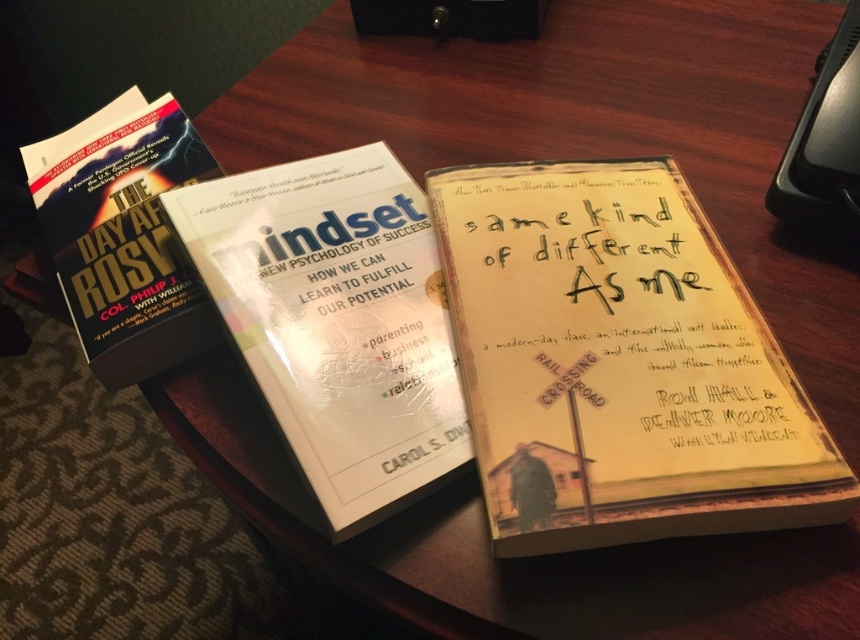
Question: Estimate the real-world distances between objects in this image. Which object is closer to the white glossy book at center?

Choices:
 (A) hardcover book at upper left
 (B) yellow paper-covered book at center

Answer: (B)

Question: Can you confirm if white glossy book at center is positioned below hardcover book at upper left?

Choices:
 (A) yes
 (B) no

Answer: (A)

Question: Does white glossy book at center have a larger size compared to hardcover book at upper left?

Choices:
 (A) yes
 (B) no

Answer: (A)

Question: Which point is closer to the camera?

Choices:
 (A) yellow paper-covered book at center
 (B) hardcover book at upper left

Answer: (A)

Question: Does yellow paper-covered book at center have a larger size compared to white glossy book at center?

Choices:
 (A) yes
 (B) no

Answer: (B)

Question: Which point is closer to the camera?

Choices:
 (A) (28, 186)
 (B) (315, 237)

Answer: (B)